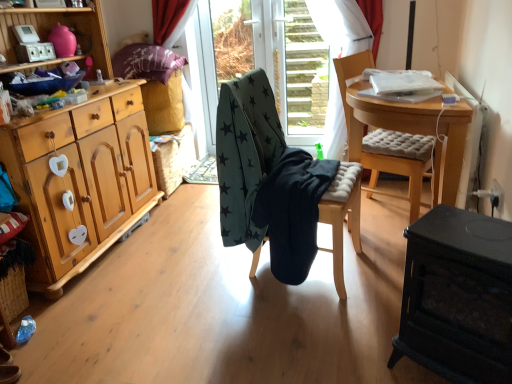
In order to face transparent plastic screen door at center, should I rotate leftwards or rightwards?

To face it directly, rotate right by 6.716 degrees.

Identify the location of dark green fabric stool at center. The image size is (512, 384). pos(342,216).

What do you see at coordinates (78, 158) in the screenshot?
I see `light wood cabinet at left` at bounding box center [78, 158].

What do you see at coordinates (278, 186) in the screenshot? This screenshot has height=384, width=512. I see `teal star-patterned fabric at center, marked as the 2th chair in a right-to-left arrangement` at bounding box center [278, 186].

Locate an element on the screen. The image size is (512, 384). light brown cushioned chair at center, the second chair from the left is located at coordinates (399, 163).

Would you say dark green fabric stool at center contains light wood cabinet at left?

No.

Which object is positioned more to the right, dark green fabric stool at center or light wood cabinet at left?

Positioned to the right is dark green fabric stool at center.

How different are the orientations of dark green fabric stool at center and light wood cabinet at left in degrees?

The angular difference between dark green fabric stool at center and light wood cabinet at left is 8.67 degrees.

Between dark green fabric stool at center and light wood cabinet at left, which one has smaller size?

dark green fabric stool at center is smaller.

Is point (488, 342) closer to viewer compared to point (374, 163)?

Yes, it is in front of point (374, 163).

Could you tell me if black matte wood table at lower right is facing light brown cushioned chair at center, the second chair from the left?

No, black matte wood table at lower right is not aimed at light brown cushioned chair at center, the second chair from the left.

From a real-world perspective, is black matte wood table at lower right over light brown cushioned chair at center, marked as the 1th chair in a right-to-left arrangement?

No, from a real-world perspective, black matte wood table at lower right is not over light brown cushioned chair at center, marked as the 1th chair in a right-to-left arrangement

Are purple floral fabric pillow at upper left and teal star-patterned fabric at center, which ranks as the first chair in left-to-right order, beside each other?

No, purple floral fabric pillow at upper left is not touching teal star-patterned fabric at center, which ranks as the first chair in left-to-right order.

In terms of width, does purple floral fabric pillow at upper left look wider or thinner when compared to teal star-patterned fabric at center, which ranks as the first chair in left-to-right order?

Considering their sizes, purple floral fabric pillow at upper left looks broader than teal star-patterned fabric at center, which ranks as the first chair in left-to-right order.

How much distance is there between purple floral fabric pillow at upper left and teal star-patterned fabric at center, marked as the 2th chair in a right-to-left arrangement?

purple floral fabric pillow at upper left and teal star-patterned fabric at center, marked as the 2th chair in a right-to-left arrangement, are 1.34 meters apart from each other.

Based on the photo, is purple floral fabric pillow at upper left oriented away from teal star-patterned fabric at center, which ranks as the first chair in left-to-right order?

purple floral fabric pillow at upper left does not have its back to teal star-patterned fabric at center, which ranks as the first chair in left-to-right order.

Is transparent glass door at center bigger or smaller than transparent plastic screen door at center?

transparent glass door at center is bigger than transparent plastic screen door at center.

Is transparent glass door at center positioned with its back to transparent plastic screen door at center?

Correct, transparent glass door at center is looking away from transparent plastic screen door at center.

From the picture: What's the angular difference between transparent glass door at center and transparent plastic screen door at center's facing directions?

0.00183 degrees separate the facing orientations of transparent glass door at center and transparent plastic screen door at center.

From the picture: Can we say transparent plastic screen door at center lies outside light wood cabinet at left?

Yes, transparent plastic screen door at center is not within light wood cabinet at left.

I want to click on screen door above the light wood cabinet at left (from the image's perspective), so click(298, 71).

Is transparent plastic screen door at center in front of or behind light wood cabinet at left in the image?

transparent plastic screen door at center is positioned farther from the viewer than light wood cabinet at left.

From the picture: Is dark green fabric stool at center wider than purple floral fabric pillow at upper left?

In fact, dark green fabric stool at center might be narrower than purple floral fabric pillow at upper left.

Looking at this image, considering the positions of objects dark green fabric stool at center and purple floral fabric pillow at upper left in the image provided, who is in front, dark green fabric stool at center or purple floral fabric pillow at upper left?

dark green fabric stool at center is more forward.

Does dark green fabric stool at center appear on the right side of purple floral fabric pillow at upper left?

Correct, you'll find dark green fabric stool at center to the right of purple floral fabric pillow at upper left.

How distant is dark green fabric stool at center from purple floral fabric pillow at upper left?

dark green fabric stool at center and purple floral fabric pillow at upper left are 1.60 meters apart.

Is dark green fabric stool at center inside the boundaries of transparent plastic screen door at center, or outside?

dark green fabric stool at center lies outside transparent plastic screen door at center.

Is point (342, 231) closer or farther from the camera than point (288, 130)?

Point (342, 231) is closer to the camera than point (288, 130).

Would you consider dark green fabric stool at center to be distant from transparent plastic screen door at center?

Yes.

Between dark green fabric stool at center and transparent plastic screen door at center, which one appears on the right side from the viewer's perspective?

transparent plastic screen door at center is more to the right.

The image size is (512, 384). I want to click on stool below the light wood cabinet at left (from the image's perspective), so click(342, 216).

What are the coordinates of `the 2nd chair above the black matte wood table at lower right (from a real-world perspective)` in the screenshot? It's located at (399, 163).

In the scene shown: Which object lies nearer to the anchor point transparent glass door at center, black matte wood table at lower right or transparent plastic screen door at center?

transparent plastic screen door at center lies closer to transparent glass door at center than the other object.

Estimate the real-world distances between objects in this image. Which object is closer to purple floral fabric pillow at upper left, light brown cushioned chair at center, marked as the 1th chair in a right-to-left arrangement, or dark green fabric stool at center?

light brown cushioned chair at center, marked as the 1th chair in a right-to-left arrangement, is positioned closer to the anchor purple floral fabric pillow at upper left.

From the image, which object appears to be nearer to black matte wood table at lower right, light wood cabinet at left or purple floral fabric pillow at upper left?

light wood cabinet at left is closer to black matte wood table at lower right.

Based on their spatial positions, is teal star-patterned fabric at center, marked as the 2th chair in a right-to-left arrangement, or light wood cabinet at left closer to transparent plastic screen door at center?

Among the two, teal star-patterned fabric at center, marked as the 2th chair in a right-to-left arrangement, is located nearer to transparent plastic screen door at center.

Considering their positions, is light brown cushioned chair at center, the second chair from the left, positioned further to teal star-patterned fabric at center, which ranks as the first chair in left-to-right order, than black matte wood table at lower right?

black matte wood table at lower right is further to teal star-patterned fabric at center, which ranks as the first chair in left-to-right order.

Considering their positions, is teal star-patterned fabric at center, which ranks as the first chair in left-to-right order, positioned closer to dark green fabric stool at center than light wood cabinet at left?

Based on the image, teal star-patterned fabric at center, which ranks as the first chair in left-to-right order, appears to be nearer to dark green fabric stool at center.

Which object lies nearer to the anchor point black matte wood table at lower right, transparent glass door at center or light brown cushioned chair at center, the second chair from the left?

light brown cushioned chair at center, the second chair from the left, is closer to black matte wood table at lower right.

Which object lies nearer to the anchor point light wood cabinet at left, dark green fabric stool at center or black matte wood table at lower right?

dark green fabric stool at center.

The width and height of the screenshot is (512, 384). I want to click on glass door between teal star-patterned fabric at center, which ranks as the first chair in left-to-right order, and transparent plastic screen door at center, along the z-axis, so click(276, 58).

Find the location of a particular element. chair positioned between teal star-patterned fabric at center, which ranks as the first chair in left-to-right order, and transparent glass door at center from near to far is located at coordinates (399, 163).

Where is `glass door between light wood cabinet at left and light brown cushioned chair at center, marked as the 1th chair in a right-to-left arrangement, in the horizontal direction`? The height and width of the screenshot is (384, 512). glass door between light wood cabinet at left and light brown cushioned chair at center, marked as the 1th chair in a right-to-left arrangement, in the horizontal direction is located at coordinates (276, 58).

Locate an element on the screen. pillow between light wood cabinet at left and black matte wood table at lower right is located at coordinates (146, 62).